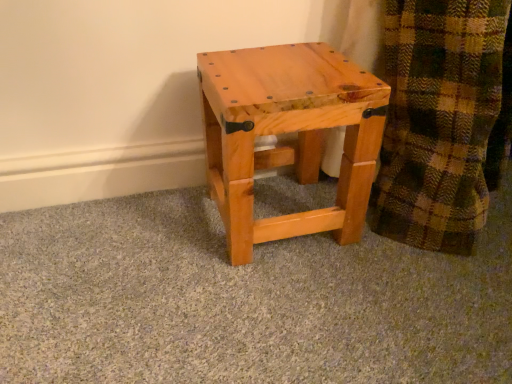
At what (x,y) coordinates should I click in order to perform the action: click on vacant area situated below natural wood stool at center (from a real-world perspective). Please return your answer as a coordinate pair (x, y). Image resolution: width=512 pixels, height=384 pixels. Looking at the image, I should click on (281, 194).